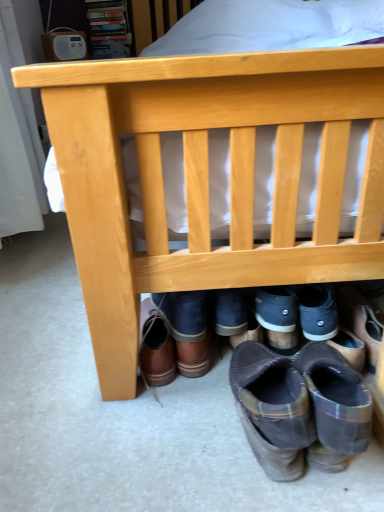
Question: Which direction should I rotate to look at brown leather boots at lower center, which ranks as the 3th footwear in right-to-left order?

Choices:
 (A) left
 (B) right

Answer: (B)

Question: Should I look upward or downward to see brown leather boot at lower center, which appears as the first footwear when viewed from the left?

Choices:
 (A) down
 (B) up

Answer: (A)

Question: From a real-world perspective, is brown suede boot at lower right positioned under brown leather boot at lower center, acting as the fourth footwear starting from the right, based on gravity?

Choices:
 (A) yes
 (B) no

Answer: (B)

Question: Does brown suede boot at lower right have a lesser width compared to brown leather boot at lower center, which appears as the first footwear when viewed from the left?

Choices:
 (A) no
 (B) yes

Answer: (A)

Question: Can you confirm if brown suede boot at lower right is taller than brown leather boot at lower center, acting as the fourth footwear starting from the right?

Choices:
 (A) no
 (B) yes

Answer: (A)

Question: Is brown leather boot at lower center, which appears as the first footwear when viewed from the left, at the back of brown suede boot at lower right?

Choices:
 (A) yes
 (B) no

Answer: (B)

Question: Does brown suede boot at lower right appear on the right side of brown leather boot at lower center, acting as the fourth footwear starting from the right?

Choices:
 (A) no
 (B) yes

Answer: (B)

Question: Is brown suede boot at lower right wider than brown leather boot at lower center, which appears as the first footwear when viewed from the left?

Choices:
 (A) yes
 (B) no

Answer: (A)

Question: Can you confirm if brown leather boot at lower center, acting as the fourth footwear starting from the right, is smaller than brown leather boots at lower center, positioned as the third footwear in left-to-right order?

Choices:
 (A) no
 (B) yes

Answer: (B)

Question: Could you tell me if brown leather boot at lower center, acting as the fourth footwear starting from the right, is turned towards brown leather boots at lower center, placed as the 2th footwear when sorted from right to left?

Choices:
 (A) no
 (B) yes

Answer: (A)

Question: From a real-world perspective, does brown leather boot at lower center, which appears as the first footwear when viewed from the left, stand above brown leather boots at lower center, positioned as the third footwear in left-to-right order?

Choices:
 (A) yes
 (B) no

Answer: (B)

Question: Does brown leather boot at lower center, acting as the fourth footwear starting from the right, have a larger size compared to brown leather boots at lower center, positioned as the third footwear in left-to-right order?

Choices:
 (A) yes
 (B) no

Answer: (B)

Question: From the image's perspective, is brown leather boot at lower center, acting as the fourth footwear starting from the right, over brown leather boots at lower center, placed as the 2th footwear when sorted from right to left?

Choices:
 (A) yes
 (B) no

Answer: (A)

Question: Is brown leather boot at lower center, which appears as the first footwear when viewed from the left, not inside brown leather boots at lower center, positioned as the third footwear in left-to-right order?

Choices:
 (A) yes
 (B) no

Answer: (A)

Question: Does brown suede boot at lower right appear on the left side of brown leather boots at lower center, which ranks as the 3th footwear in right-to-left order?

Choices:
 (A) no
 (B) yes

Answer: (A)